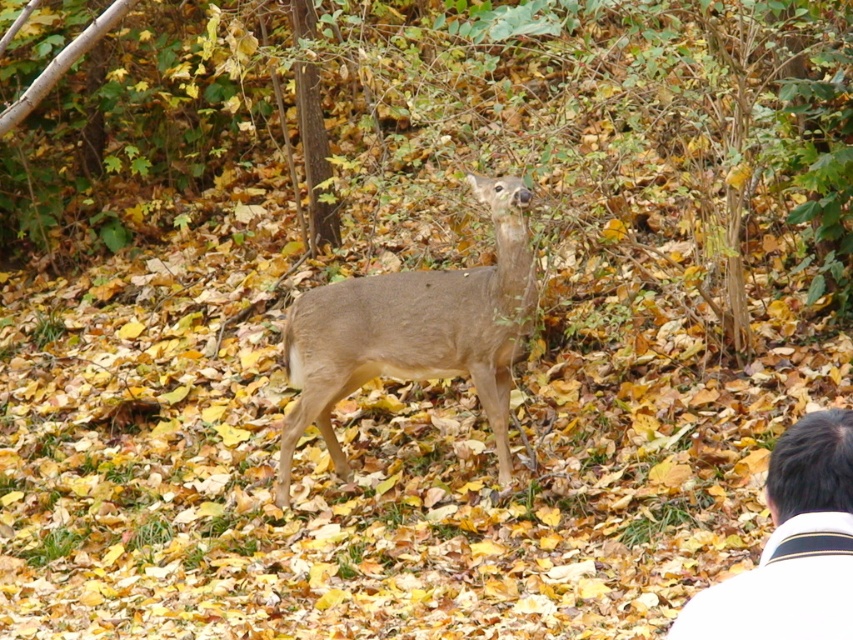
You are a hiker who wants to take a photo of the light brown fur at center and the white shirt at lower right. Can you fit both subjects in the frame of your camera which has a maximum field of view of 10 feet?

The distance between the light brown fur at center and the white shirt at lower right is 10.91 feet, which exceeds the camera field of view of 10 feet. Therefore, both subjects cannot be captured in a single frame.

You are an observer in the autumn forest scene. You notice the light brown fur at center and the white shirt at lower right. Which object takes up more space in the image?

The light brown fur at center takes up more space in the image than the white shirt at lower right because it is bigger.